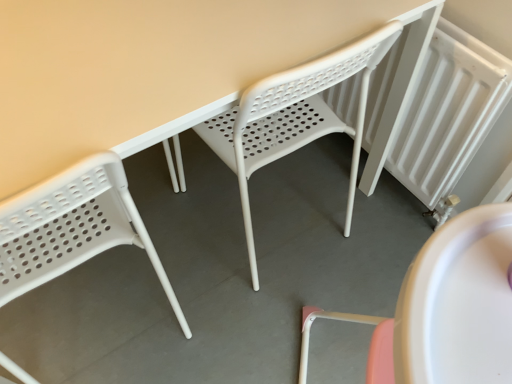
Where is `vacant region to the right of white plastic chair at left, arranged as the 1th chair when viewed from the left`? The width and height of the screenshot is (512, 384). vacant region to the right of white plastic chair at left, arranged as the 1th chair when viewed from the left is located at coordinates (223, 311).